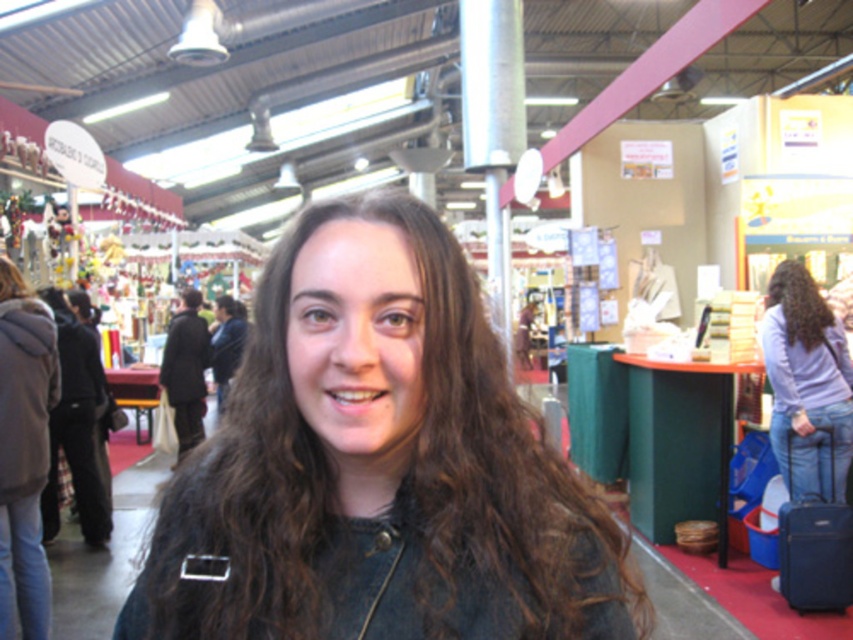
Question: Estimate the real-world distances between objects in this image. Which object is closer to the curly brown hair at right?

Choices:
 (A) black wool coat at left
 (B) fuzzy gray coat at left

Answer: (B)

Question: Among these points, which one is farthest from the camera?

Choices:
 (A) (788, 285)
 (B) (206, 336)

Answer: (B)

Question: Does fuzzy gray coat at left appear under black wool coat at left?

Choices:
 (A) no
 (B) yes

Answer: (B)

Question: Which of the following is the closest to the observer?

Choices:
 (A) fuzzy gray coat at left
 (B) black wool coat at left
 (C) light purple fabric at center

Answer: (A)

Question: Is the position of light purple fabric at center less distant than that of black wool coat at left?

Choices:
 (A) no
 (B) yes

Answer: (B)

Question: Is dark brown hair at center closer to the viewer compared to light purple fabric at center?

Choices:
 (A) no
 (B) yes

Answer: (B)